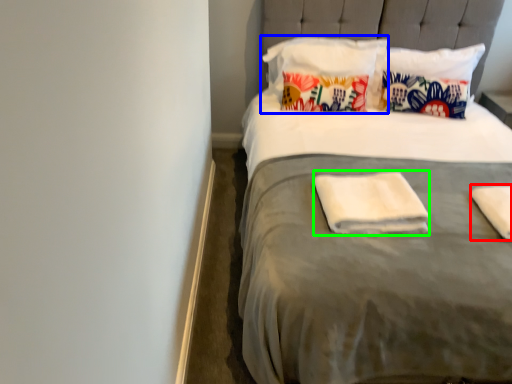
Question: Which is farther away from material (highlighted by a red box)? pillow (highlighted by a blue box) or material (highlighted by a green box)?

Choices:
 (A) pillow
 (B) material

Answer: (A)